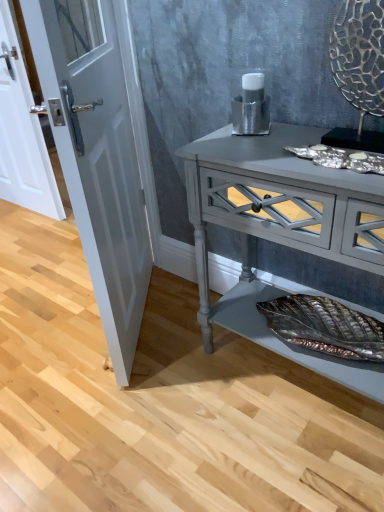
At what (x,y) coordinates should I click in order to perform the action: click on empty space that is to the right of white glossy door at left, arranged as the first door when viewed from the right. Please return your answer as a coordinate pair (x, y). Looking at the image, I should click on (172, 316).